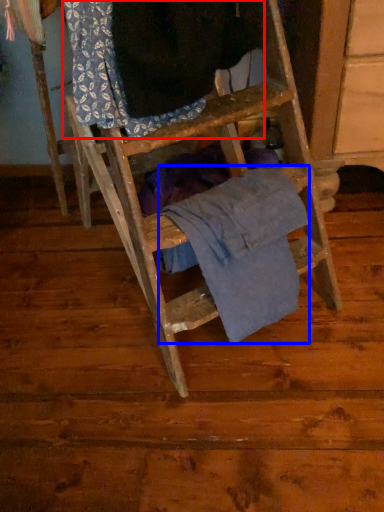
Question: Which point is further to the camera, clothing (highlighted by a red box) or clothing (highlighted by a blue box)?

Choices:
 (A) clothing
 (B) clothing

Answer: (B)